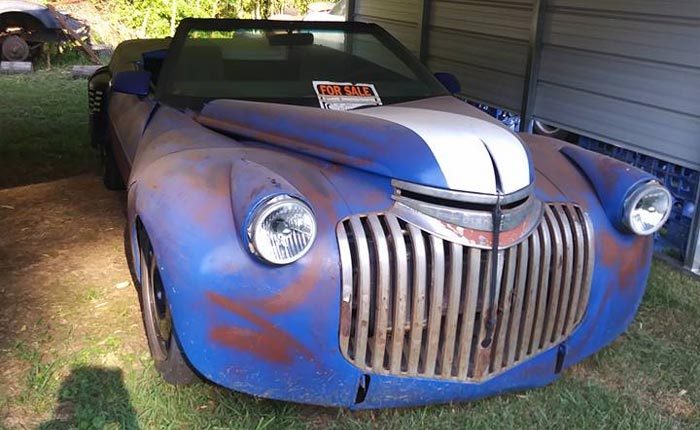
This screenshot has width=700, height=430. In order to click on seats in this screenshot , I will do `click(211, 60)`.